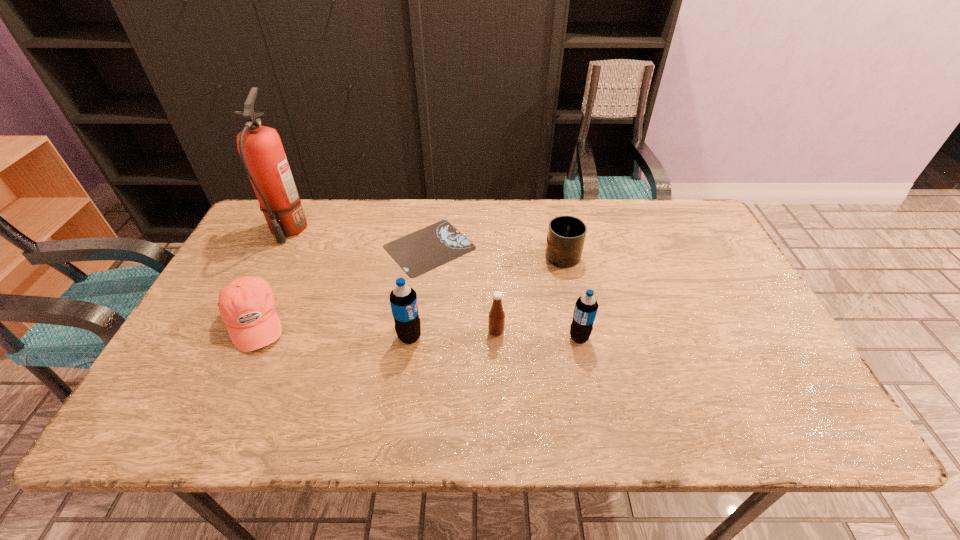
Identify the location of the second tallest object. The image size is (960, 540). (403, 299).

This screenshot has height=540, width=960. I want to click on the taller soda bottle, so click(x=403, y=299).

Where is `the right soda bottle`? This screenshot has width=960, height=540. the right soda bottle is located at coordinates (586, 306).

Locate an element on the screen. the fifth shortest object is located at coordinates [x=586, y=306].

The width and height of the screenshot is (960, 540). Find the location of `fire extinguisher`. fire extinguisher is located at coordinates (260, 147).

You are a GUI agent. You are given a task and a screenshot of the screen. Output one action in this format:
    pyautogui.click(x=<x>, y=<y>)
    Task: Click on the baseball cap
    The width and height of the screenshot is (960, 540).
    Given the screenshot: What is the action you would take?
    pyautogui.click(x=247, y=305)

The height and width of the screenshot is (540, 960). I want to click on mug, so click(566, 235).

Find the location of a particular element. mousepad is located at coordinates (419, 252).

Where is `the third object from right to left`? The height and width of the screenshot is (540, 960). the third object from right to left is located at coordinates (496, 322).

The height and width of the screenshot is (540, 960). Identify the location of the fourth shortest object. (496, 322).